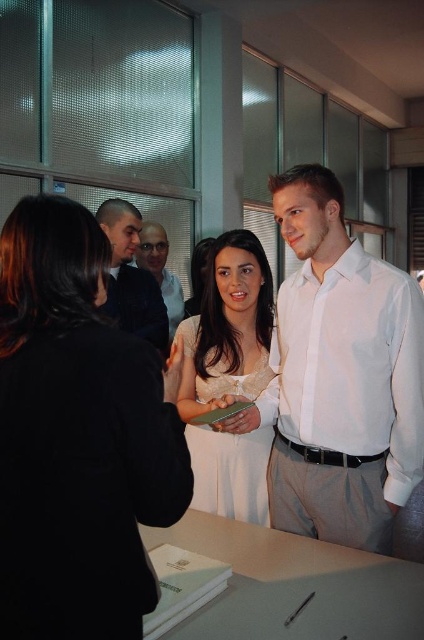
Question: Does white satin dress at center appear over matte black shirt at center?

Choices:
 (A) no
 (B) yes

Answer: (A)

Question: Which point is closer to the camera?

Choices:
 (A) white satin shirt at upper right
 (B) dark blue suit at center
 (C) white satin dress at center
 (D) matte black shirt at center

Answer: (C)

Question: Can you confirm if white satin dress at center is positioned above dark blue suit at center?

Choices:
 (A) yes
 (B) no

Answer: (B)

Question: Considering the real-world distances, which object is farthest from the dark blue suit at center?

Choices:
 (A) white satin shirt at upper right
 (B) white satin dress at center
 (C) white lace dress at center

Answer: (B)

Question: Estimate the real-world distances between objects in this image. Which object is farther from the white satin dress at center?

Choices:
 (A) matte black shirt at center
 (B) dark blue suit at center
 (C) white lace dress at center

Answer: (A)

Question: Can you confirm if dark blue suit at center is thinner than matte black shirt at center?

Choices:
 (A) no
 (B) yes

Answer: (A)